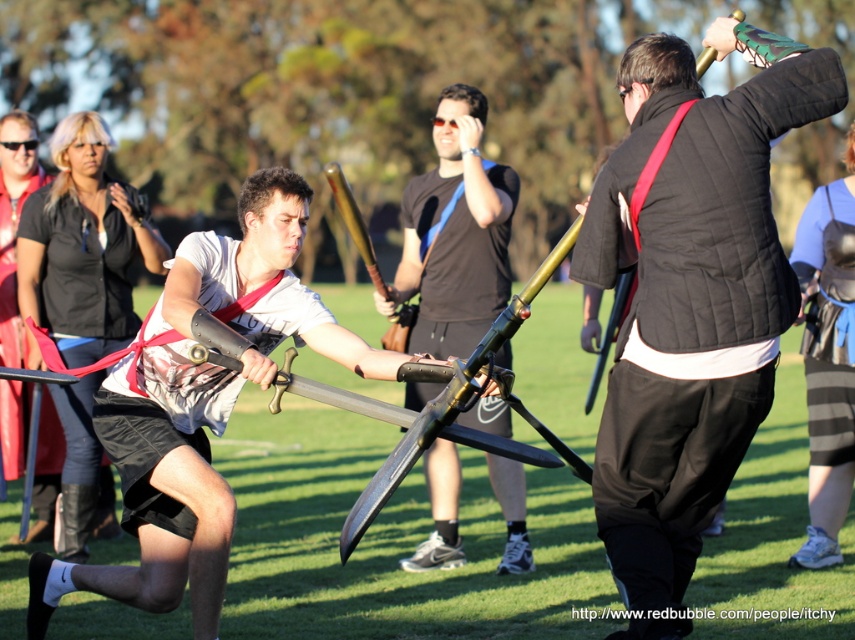
You are a knight in the middle of a tournament. You need to grab the closest object to you between the matte silver sword at center and the black leather armor at lower right. Which one should you choose?

The matte silver sword at center is closer to the viewer than the black leather armor at lower right, so you should grab the matte silver sword at center.

You are a photographer at the medieval event and want to capture a photo where both the matte black padded armor at center and the matte white shirt at left are clearly visible. Considering their heights, which object should you focus on first to ensure both are in frame?

The matte black padded armor at center has a lesser height compared to the matte white shirt at left. Therefore, you should focus on the matte white shirt at left first to ensure both are in frame since it is taller and will require more attention to composition.

You are a photographer trying to capture the action between the two fighters in the scene. You want to ensure that both the matte black padded armor at center and the matte white shirt at left are clearly visible in your shot. Based on their sizes, which object should you focus on first to ensure it doesn

The matte black padded armor at center is smaller than the matte white shirt at left. Therefore, you should focus on the matte white shirt at left first, as it is larger and easier to capture clearly before adjusting for the smaller matte black padded armor at center.